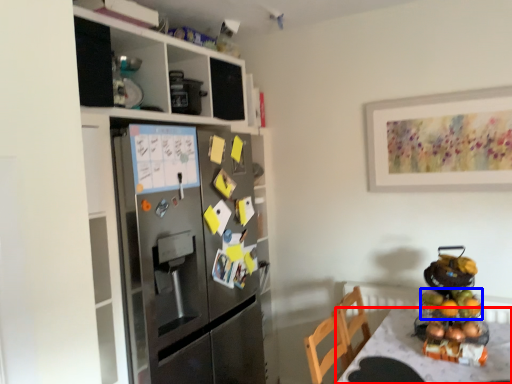
Question: Which of the following is the closest to the observer, desk (highlighted by a red box) or fruit (highlighted by a blue box)?

Choices:
 (A) desk
 (B) fruit

Answer: (A)